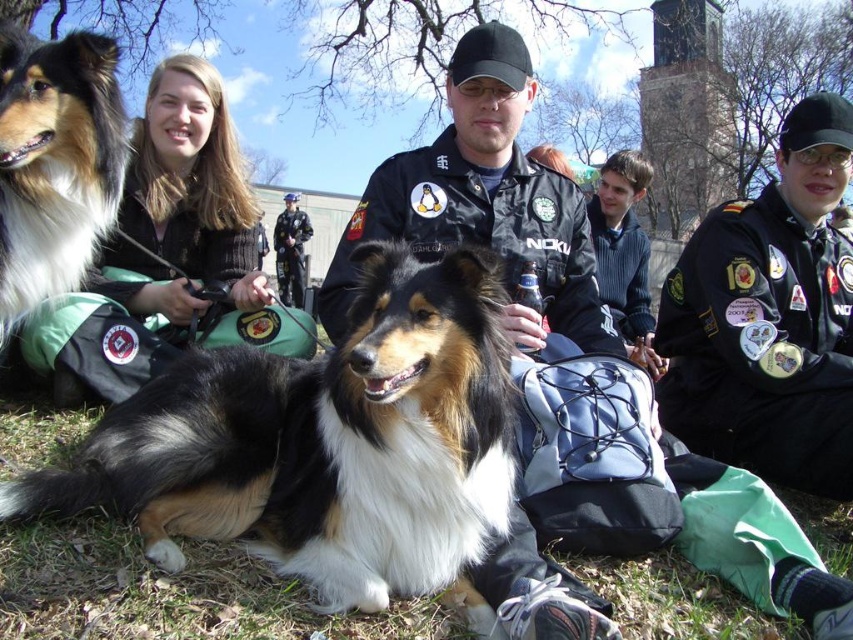
You are trying to decide where to place a small picnic basket in the image. The basket requires a spot that is wider than the blonde hair at center. Can the fuzzy green grass at lower center provide enough space for the basket?

The fuzzy green grass at lower center might be wider than the blonde hair at center, so it could potentially provide enough space for the picnic basket if the grass area is indeed wider.

You are a photographer trying to capture a clear shot of the two Shetland Sheepdogs. The fuzzy green grass at lower center and the blonde hair at center are in the way. Which object should you move closer to the camera to ensure the dogs are in focus?

The fuzzy green grass at lower center has a smaller size compared to blonde hair at center. To ensure the dogs are in focus, you should move the fuzzy green grass at lower center closer to the camera since it is smaller and might be blocking the view less obstructively.